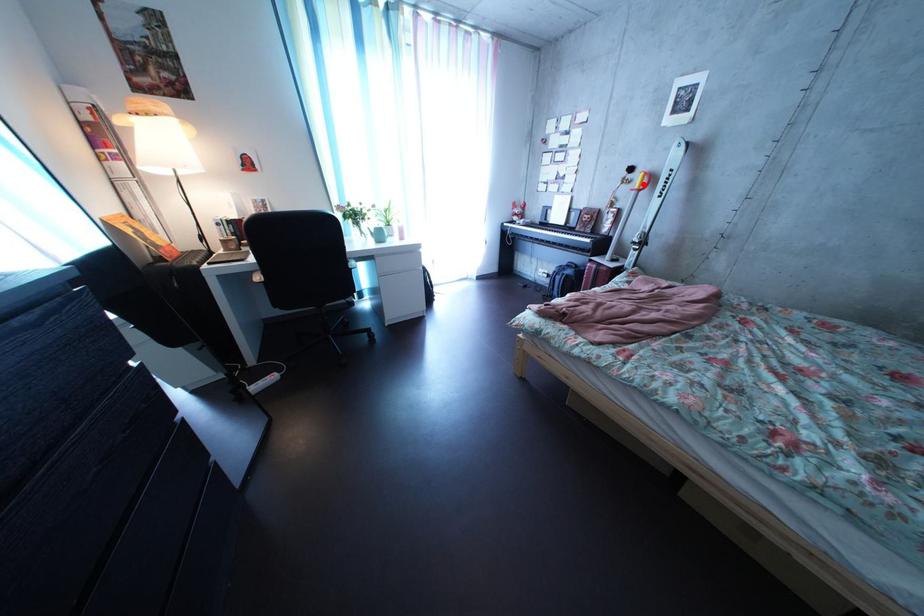
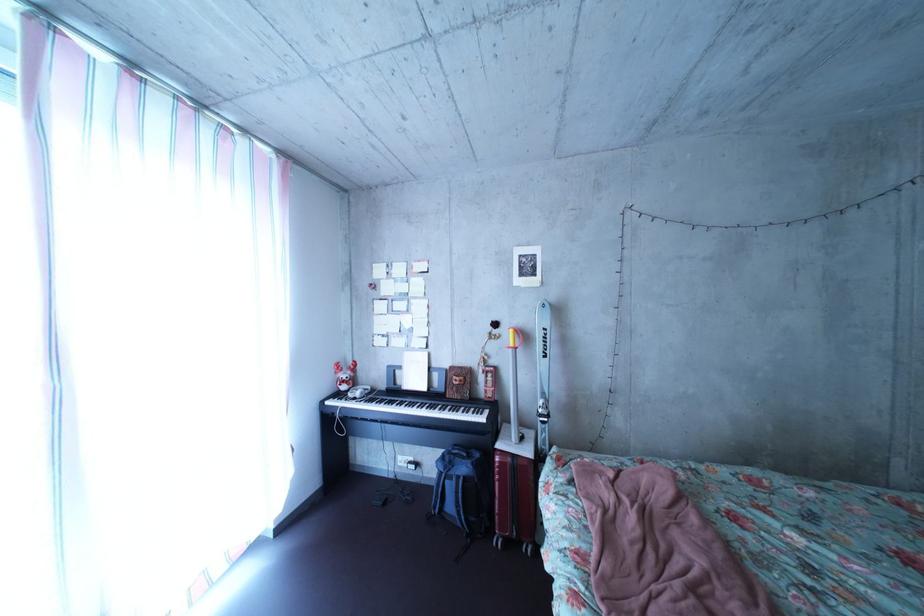
In the second image, find the point that corresponds to the highlighted location in the first image.

(509, 339)